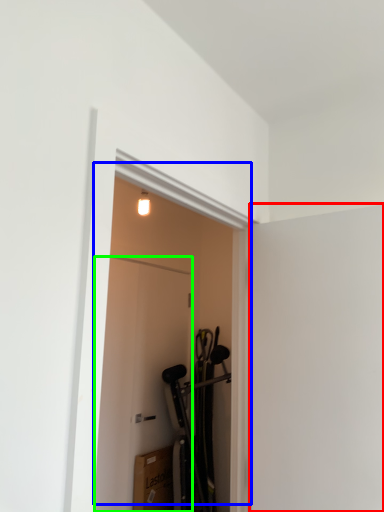
Question: Considering the real-world distances, which object is closest to screen door (highlighted by a red box)? door (highlighted by a blue box) or door (highlighted by a green box).

Choices:
 (A) door
 (B) door

Answer: (B)